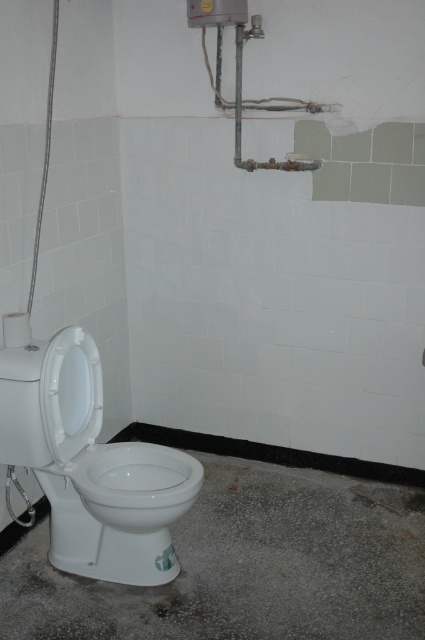
You are a plumber inspecting the bathroom. You need to determine if the white glossy toilet bowl at center can be replaced with a wider model. The new toilet requires a minimum clearance of 25 inches between the walls on either side. Based on the current toilet bowl at center and the metallic gray pipes at upper center, can you estimate if there is enough space?

The white glossy toilet bowl at center is narrower than the metallic gray pipes at upper center. Since the pipes are wider, there might be sufficient space for a wider toilet, but the exact dimensions of the pipes and the available wall space are needed for an accurate assessment.

You are a contractor assessing the bathroom for repairs. You need to install a new rectangular tile that is 1.2 meters wide. The tile must be placed either on the gray concrete floor at lower center or along the metallic gray pipes at upper center. Based on the dimensions provided, where should you place the tile?

The gray concrete floor at lower center has a larger width than the metallic gray pipes at upper center. Since the tile is 1.2 meters wide, it should be placed on the gray concrete floor at lower center where there is enough space to accommodate its width.

You are standing in the bathroom and see two points marked on the wall. The first point is at coordinate point (297, 452) and the second is at point (289, 160). Which point is closer to you?

Point (289, 160) is closer to you because it is less further to the camera than point (297, 452).